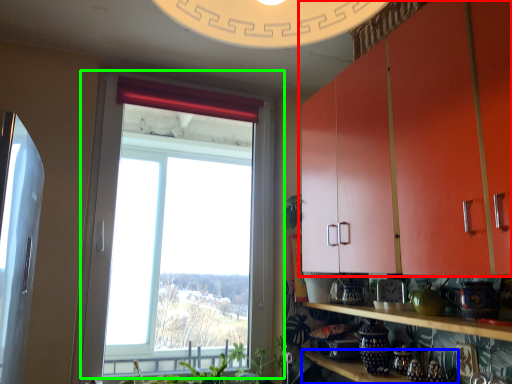
Question: Considering the real-world distances, which object is farthest from cabinetry (highlighted by a red box)? shelf (highlighted by a blue box) or window (highlighted by a green box)?

Choices:
 (A) shelf
 (B) window

Answer: (B)